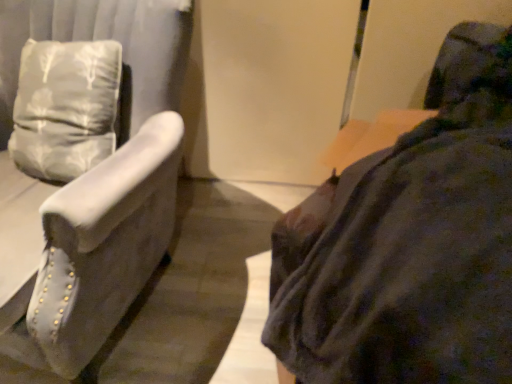
Question: Is point (131, 150) positioned closer to the camera than point (483, 162)?

Choices:
 (A) closer
 (B) farther

Answer: (B)

Question: Considering the positions of suede-like gray armchair at left, arranged as the first furniture when viewed from the left, and dark fabric couch at right, the second furniture when ordered from left to right, in the image, is suede-like gray armchair at left, arranged as the first furniture when viewed from the left, wider or thinner than dark fabric couch at right, the second furniture when ordered from left to right,?

Choices:
 (A) thin
 (B) wide

Answer: (A)

Question: In terms of size, does suede-like gray armchair at left, arranged as the first furniture when viewed from the left, appear bigger or smaller than dark fabric couch at right, the second furniture when ordered from left to right?

Choices:
 (A) small
 (B) big

Answer: (B)

Question: From a real-world perspective, relative to suede-like gray armchair at left, arranged as the first furniture when viewed from the left, is dark fabric couch at right, the 1th furniture positioned from the right, vertically above or below?

Choices:
 (A) below
 (B) above

Answer: (B)

Question: In terms of width, does dark fabric couch at right, the second furniture when ordered from left to right, look wider or thinner when compared to suede-like gray armchair at left, arranged as the first furniture when viewed from the left?

Choices:
 (A) thin
 (B) wide

Answer: (B)

Question: Is point (321, 302) positioned closer to the camera than point (80, 291)?

Choices:
 (A) farther
 (B) closer

Answer: (B)

Question: In terms of size, does dark fabric couch at right, the second furniture when ordered from left to right, appear bigger or smaller than suede-like gray armchair at left, arranged as the first furniture when viewed from the left?

Choices:
 (A) big
 (B) small

Answer: (B)